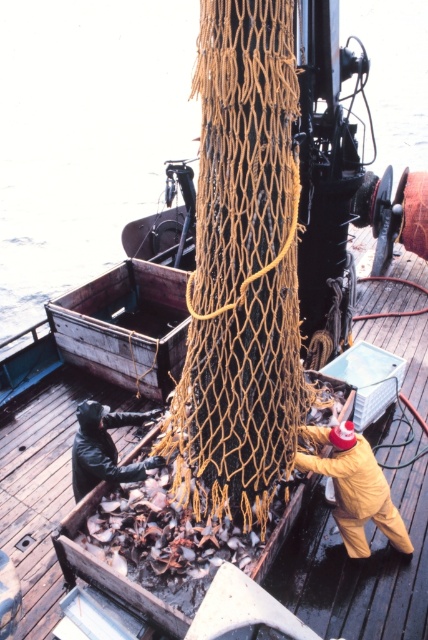
You are on a fishing boat and need to hand a tool to the person in the yellow matte overall at lower right and the person in the black rubber gloves at lower left. Which person will require you to throw the tool farther?

The black rubber gloves at lower left will require throwing the tool farther because they are farther from the viewer compared to the yellow matte overall at lower right.

You are a safety inspector on the fishing vessel and need to ensure workers are maintaining a safe distance of at least 2 meters apart. Are the workers wearing yellow matte overall at lower right and black rubber gloves at lower left complying with the safety regulation?

The distance between the yellow matte overall at lower right and black rubber gloves at lower left is 1.89 meters, which is less than the required 2 meters. Therefore, they are not complying with the safety regulation.

You are a safety inspector on the fishing vessel. You need to ensure that the yellow matte overall at lower right and the black rubber gloves at lower left are properly sized for the workers. Based on the scene, which item is more likely to be correctly sized for an average worker?

The yellow matte overall at lower right is larger in size than the black rubber gloves at lower left. Since the overall is larger, it may be more appropriately sized for an average worker compared to the smaller gloves.